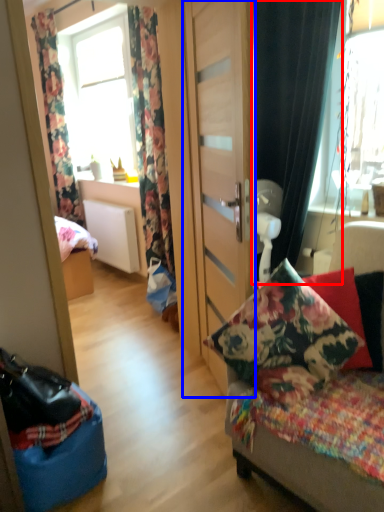
Question: Which of the following is the closest to the observer, curtain (highlighted by a red box) or door (highlighted by a blue box)?

Choices:
 (A) curtain
 (B) door

Answer: (B)